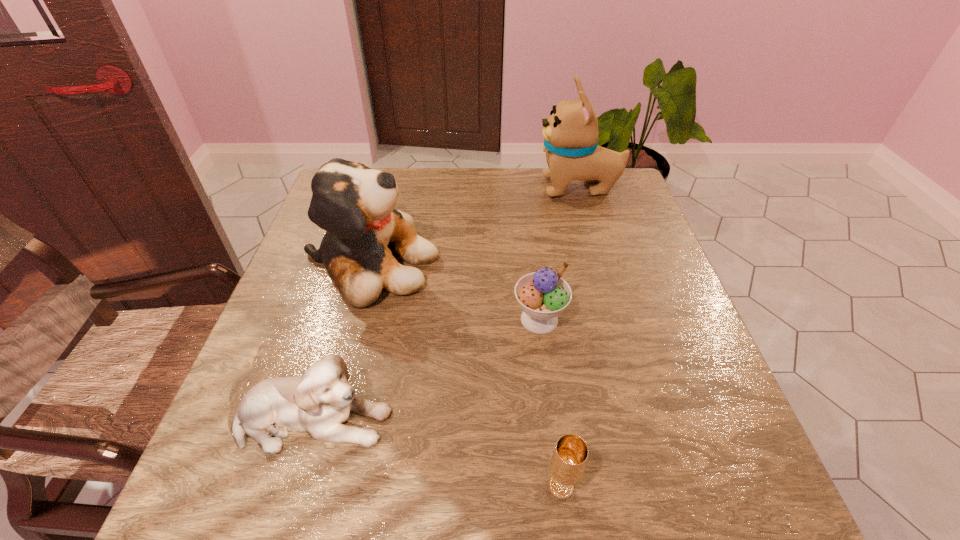
Find the location of a particular element. Image resolution: width=960 pixels, height=540 pixels. vacant area that lies between the chalice and the second nearest puppy is located at coordinates (466, 375).

At what (x,y) coordinates should I click in order to perform the action: click on vacant space that is in between the nearest puppy and the second farthest puppy. Please return your answer as a coordinate pair (x, y). This screenshot has width=960, height=540. Looking at the image, I should click on (342, 342).

The height and width of the screenshot is (540, 960). Find the location of `free spot between the icecream and the second farthest puppy`. free spot between the icecream and the second farthest puppy is located at coordinates click(x=455, y=292).

Where is `object that ranks as the closest to the shortest puppy`? This screenshot has width=960, height=540. object that ranks as the closest to the shortest puppy is located at coordinates (355, 205).

The height and width of the screenshot is (540, 960). I want to click on the third closest object to the second farthest puppy, so pos(570,134).

The image size is (960, 540). In order to click on puppy that is the closest to the farthest object in this screenshot , I will do `click(355, 205)`.

Choose which puppy is the nearest neighbor to the second farthest puppy. Please provide its 2D coordinates. Your answer should be formatted as a tuple, i.e. [(x, y)], where the tuple contains the x and y coordinates of a point satisfying the conditions above.

[(319, 402)]

This screenshot has height=540, width=960. Identify the location of vacant space that satisfies the following two spatial constraints: 1. at the face of the second farthest puppy; 2. on the right side of the icecream. (355, 319).

I want to click on free space that satisfies the following two spatial constraints: 1. on the front-facing side of the nearest object; 2. on the left side of the nearest puppy, so click(x=295, y=487).

What are the coordinates of `vacant space that satisfies the following two spatial constraints: 1. at the face of the second nearest puppy; 2. on the back side of the icecream` in the screenshot? It's located at (355, 319).